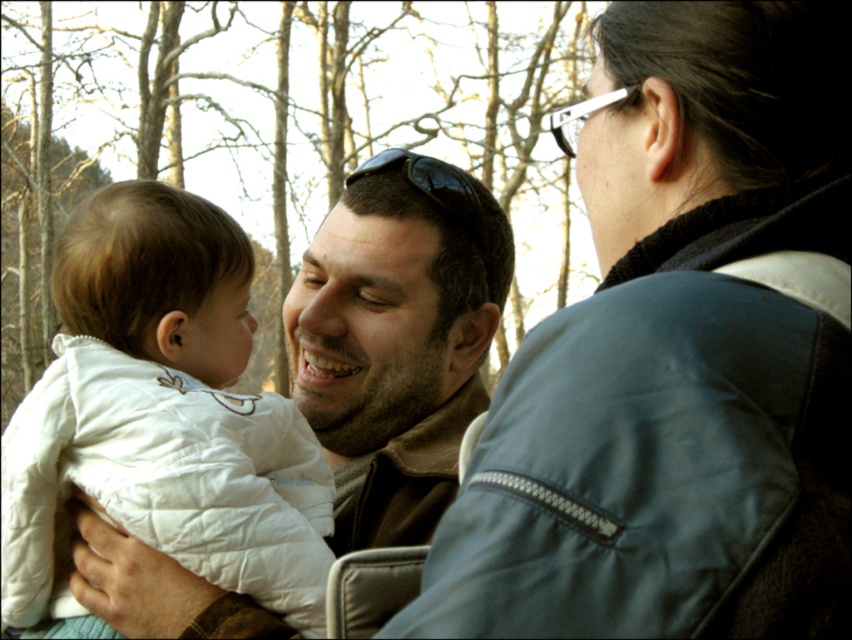
Can you confirm if blue leather jacket at center is bigger than black matte sunglasses at center?

Yes.

Is point (469, 472) in front of point (455, 177)?

Yes, point (469, 472) is closer to viewer.

Between point (453, 528) and point (403, 168), which one is positioned in front?

Point (453, 528) is more forward.

You are a GUI agent. You are given a task and a screenshot of the screen. Output one action in this format:
    pyautogui.click(x=<x>, y=<y>)
    Task: Click on the blue leather jacket at center
    The width and height of the screenshot is (852, 640).
    Given the screenshot: What is the action you would take?
    pyautogui.click(x=676, y=356)

Which of these two, blue leather jacket at center or white quilted jacket at left, stands shorter?

blue leather jacket at center

The height and width of the screenshot is (640, 852). In order to click on blue leather jacket at center in this screenshot , I will do `click(676, 356)`.

Based on the photo, which of these two, white quilted jacket at left or black matte sunglasses at center, stands taller?

Standing taller between the two is white quilted jacket at left.

Measure the distance between white quilted jacket at left and black matte sunglasses at center.

They are 1.13 meters apart.

At what (x,y) coordinates should I click in order to perform the action: click on white quilted jacket at left. Please return your answer as a coordinate pair (x, y). Looking at the image, I should click on (163, 413).